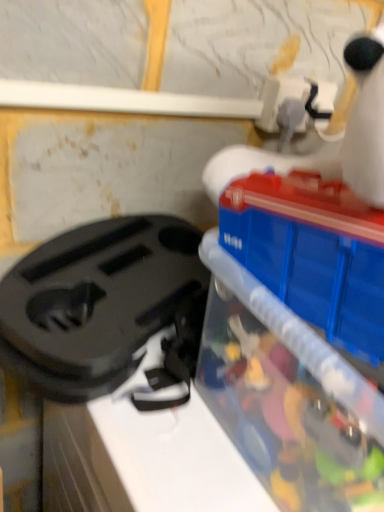
Question: Considering the positions of point (155, 248) and point (241, 333), is point (155, 248) closer or farther from the camera than point (241, 333)?

Choices:
 (A) closer
 (B) farther

Answer: (B)

Question: Do you think black plastic bag at left is within translucent plastic container at right, or outside of it?

Choices:
 (A) outside
 (B) inside

Answer: (A)

Question: From a real-world perspective, is black plastic bag at left positioned above or below translucent plastic container at right?

Choices:
 (A) below
 (B) above

Answer: (A)

Question: Based on their sizes in the image, would you say translucent plastic container at right is bigger or smaller than black plastic bag at left?

Choices:
 (A) small
 (B) big

Answer: (B)

Question: Visually, is translucent plastic container at right positioned to the left or to the right of black plastic bag at left?

Choices:
 (A) right
 (B) left

Answer: (A)

Question: Does point (336, 498) appear closer or farther from the camera than point (107, 388)?

Choices:
 (A) farther
 (B) closer

Answer: (B)

Question: Is translucent plastic container at right inside or outside of black plastic bag at left?

Choices:
 (A) outside
 (B) inside

Answer: (A)